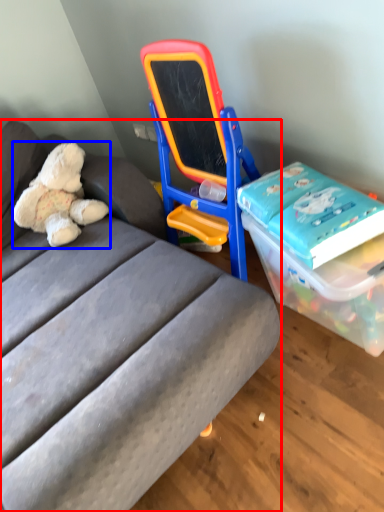
Question: Which of the following is the farthest to the observer, studio couch (highlighted by a red box) or teddy bear (highlighted by a blue box)?

Choices:
 (A) studio couch
 (B) teddy bear

Answer: (B)